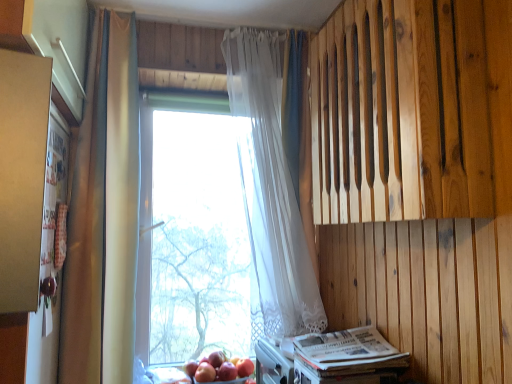
Question: Based on their positions, is white sheer curtain at center, the second curtain positioned from the left, located to the left or right of transparent glass window at center?

Choices:
 (A) left
 (B) right

Answer: (B)

Question: In terms of width, does white sheer curtain at center, placed as the 1th curtain when sorted from right to left, look wider or thinner when compared to transparent glass window at center?

Choices:
 (A) thin
 (B) wide

Answer: (B)

Question: Which of these objects is positioned farthest from the red matte apple at lower center, acting as the 1th apple starting from the right?

Choices:
 (A) natural wood paneling at upper right
 (B) white paper magazine at lower right
 (C) transparent glass window at center
 (D) red matte apple at lower center, placed as the 3th apple when sorted from right to left
 (E) white sheer curtain at center, placed as the 1th curtain when sorted from right to left

Answer: (A)

Question: Estimate the real-world distances between objects in this image. Which object is closer to the red matte apple at lower center, acting as the 1th apple starting from the right?

Choices:
 (A) natural wood paneling at upper right
 (B) matte gold curtain at left, the first curtain when ordered from left to right
 (C) transparent glass window at center
 (D) glossy red apple at lower center, which ranks as the second apple in right-to-left order
 (E) white paper magazine at lower right

Answer: (D)